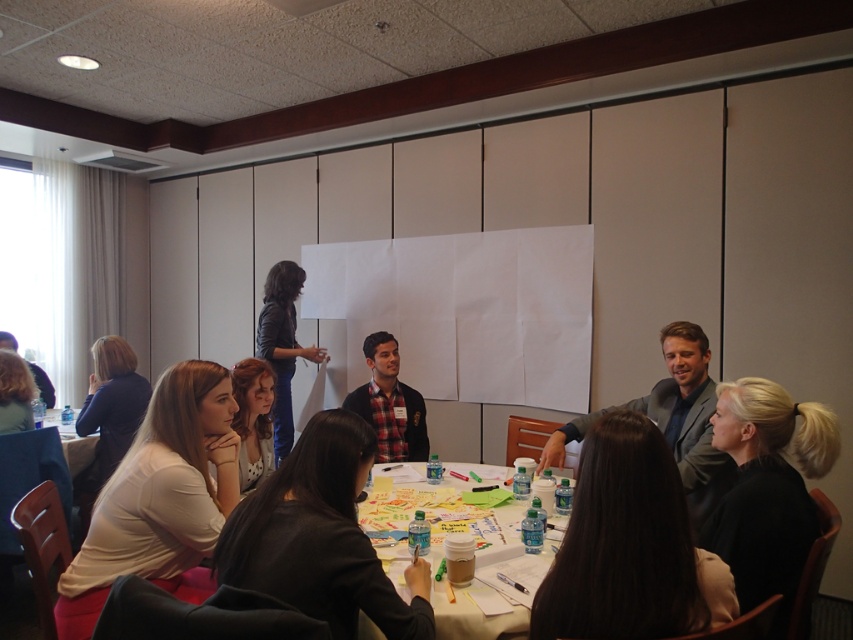
Question: Which point is closer to the camera?

Choices:
 (A) dark brown hair at lower right
 (B) white paper at center

Answer: (A)

Question: Which object appears farthest from the camera in this image?

Choices:
 (A) white matte shirt at lower left
 (B) gray fabric suit at center
 (C) clear plastic water bottle at lower left
 (D) dark gray shirt at lower left

Answer: (C)

Question: Which point is farther from the camera taking this photo?

Choices:
 (A) (398, 417)
 (B) (74, 440)
 (C) (409, 616)

Answer: (B)

Question: Does black matte hair at lower right have a greater width compared to black leather jacket at upper center?

Choices:
 (A) no
 (B) yes

Answer: (A)

Question: Is plaid fabric shirt at center positioned in front of clear plastic water bottle at lower left?

Choices:
 (A) yes
 (B) no

Answer: (A)

Question: Does white matte shirt at lower left appear on the left side of black leather jacket at upper center?

Choices:
 (A) yes
 (B) no

Answer: (B)